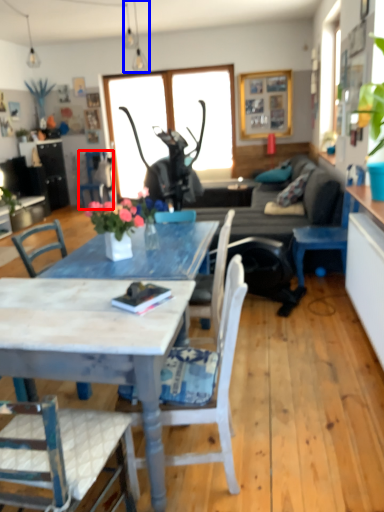
Question: Among these objects, which one is nearest to the camera, chair (highlighted by a red box) or lamp (highlighted by a blue box)?

Choices:
 (A) chair
 (B) lamp

Answer: (B)